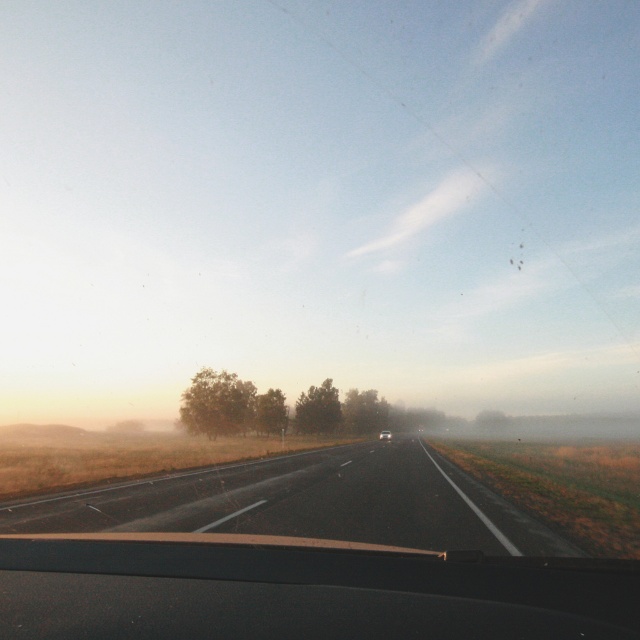
Is black asphalt highway at center wider than matte black car at center?

Indeed, black asphalt highway at center has a greater width compared to matte black car at center.

Who is more forward, (168,524) or (388,438)?

Point (168,524)

Does point (88, 488) lie in front of point (381, 435)?

Yes, point (88, 488) is closer to viewer.

In order to click on black asphalt highway at center in this screenshot , I will do `click(307, 502)`.